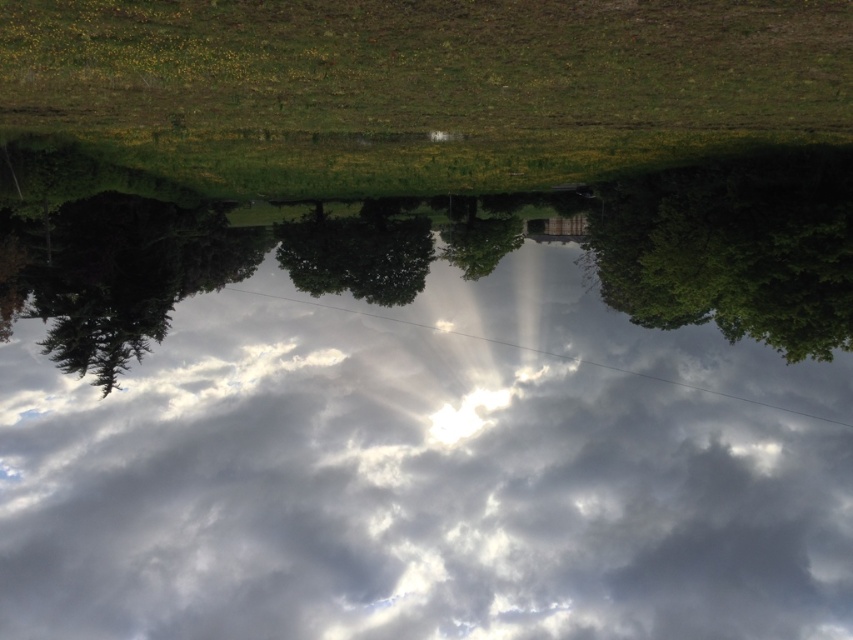
Looking at this image, you are standing in the grassy field and see the white fluffy cloud at center and the green leafy tree at center. Which object is positioned more to the left?

The white fluffy cloud at center is positioned more to the left than the green leafy tree at center.